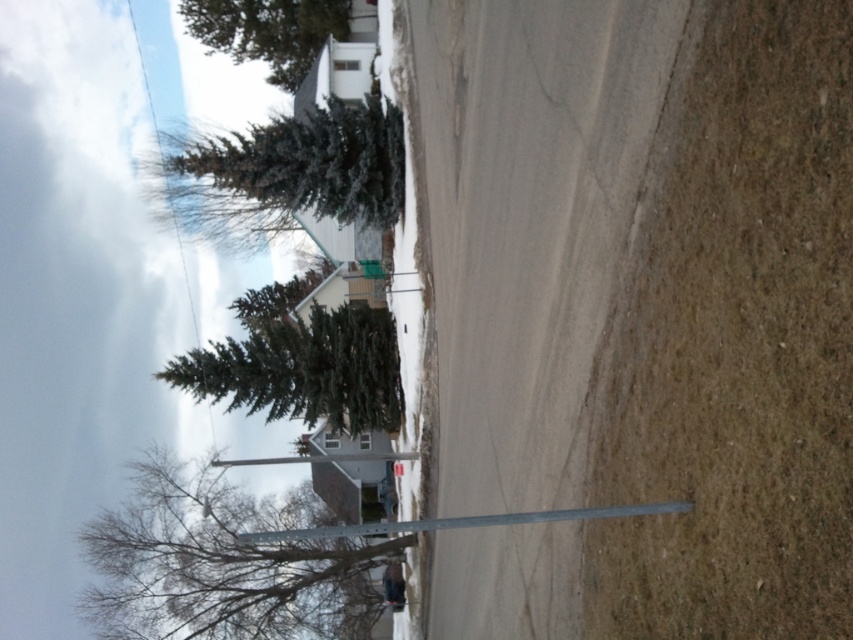
Question: Which object is positioned closest to the green textured pine tree at upper center?

Choices:
 (A) green textured evergreen at upper center
 (B) green textured evergreen at upper left
 (C) black matte skier at center
 (D) green matte evergreen tree at upper left

Answer: (A)

Question: Is green textured evergreen at upper left positioned in front of green matte evergreen tree at upper left?

Choices:
 (A) yes
 (B) no

Answer: (A)

Question: Can you confirm if green matte evergreen tree at upper left is smaller than green textured pine tree at upper center?

Choices:
 (A) no
 (B) yes

Answer: (A)

Question: Is the position of green textured evergreen at upper center less distant than that of black matte skier at center?

Choices:
 (A) yes
 (B) no

Answer: (A)

Question: Which point appears closest to the camera in this image?

Choices:
 (A) (312, 205)
 (B) (225, 392)
 (C) (289, 51)
 (D) (125, 556)

Answer: (A)

Question: Among these points, which one is farthest from the camera?

Choices:
 (A) (331, 560)
 (B) (395, 573)
 (C) (363, 218)

Answer: (B)